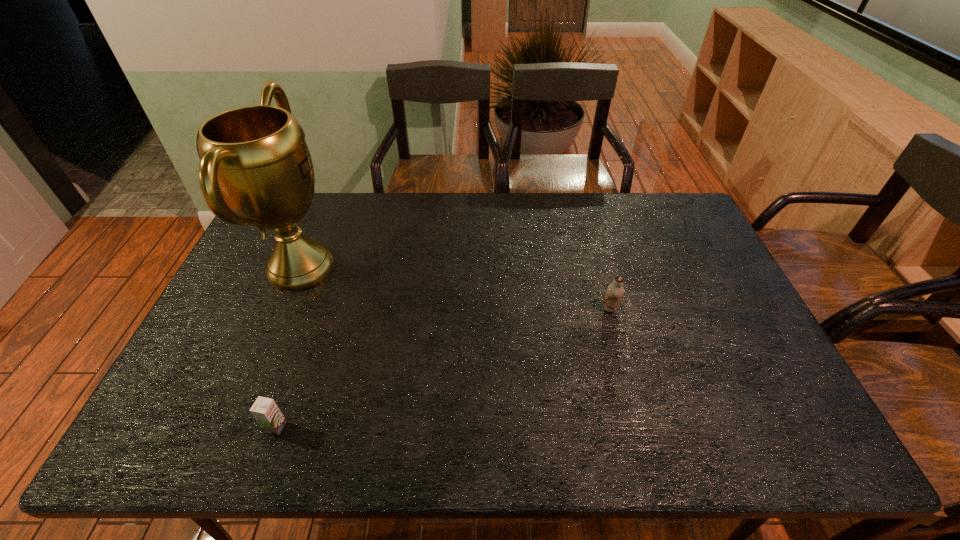
At what (x,y) coordinates should I click in order to perform the action: click on vacant space that satisfies the following two spatial constraints: 1. on the surface of the trophy cup with symbols; 2. on the back side of the nearest object. Please return your answer as a coordinate pair (x, y). The width and height of the screenshot is (960, 540). Looking at the image, I should click on (234, 427).

The height and width of the screenshot is (540, 960). I want to click on vacant space that satisfies the following two spatial constraints: 1. on the surface of the right chocolate milk with symbols; 2. on the left side of the tallest object, so click(x=283, y=309).

In order to click on free spot that satisfies the following two spatial constraints: 1. on the surface of the trophy cup with symbols; 2. on the left side of the left chocolate milk in this screenshot , I will do `click(234, 427)`.

Where is `vacant space that satisfies the following two spatial constraints: 1. on the surface of the trophy cup with symbols; 2. on the back side of the nearer chocolate milk`? The height and width of the screenshot is (540, 960). vacant space that satisfies the following two spatial constraints: 1. on the surface of the trophy cup with symbols; 2. on the back side of the nearer chocolate milk is located at coordinates (234, 427).

Identify the location of blank space that satisfies the following two spatial constraints: 1. on the surface of the tallest object with symbols; 2. on the right side of the farther chocolate milk. (283, 309).

At what (x,y) coordinates should I click in order to perform the action: click on vacant area that satisfies the following two spatial constraints: 1. on the surface of the tallest object with symbols; 2. on the back side of the right chocolate milk. Please return your answer as a coordinate pair (x, y). This screenshot has height=540, width=960. Looking at the image, I should click on (283, 309).

At what (x,y) coordinates should I click in order to perform the action: click on vacant space that satisfies the following two spatial constraints: 1. on the back side of the rightmost object; 2. on the right side of the nearest object. Please return your answer as a coordinate pair (x, y). This screenshot has height=540, width=960. Looking at the image, I should click on (317, 309).

This screenshot has height=540, width=960. I want to click on vacant space that satisfies the following two spatial constraints: 1. on the surface of the trophy cup with symbols; 2. on the right side of the shorter chocolate milk, so click(x=234, y=427).